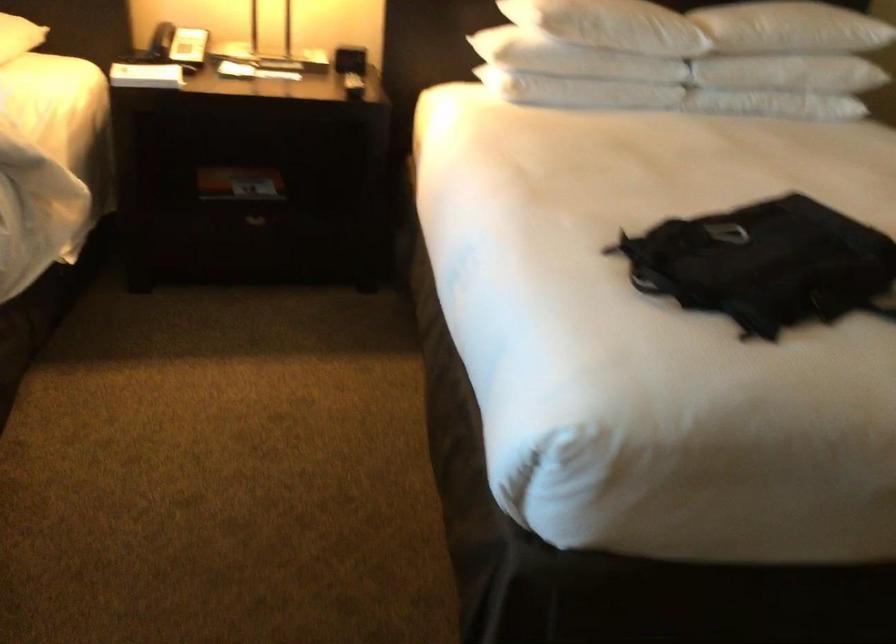
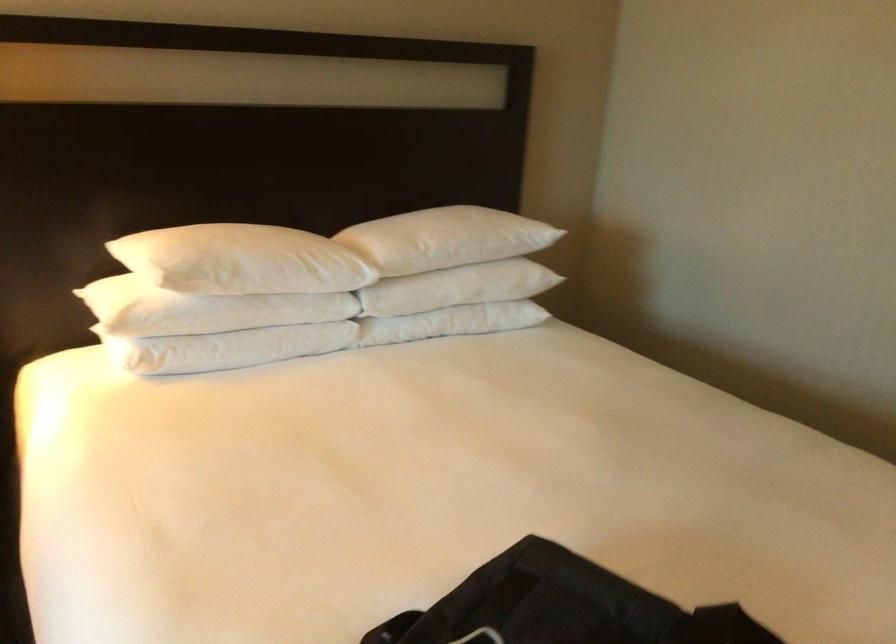
Question: Based on the continuous images, in which direction is the camera rotating? Reply with the corresponding letter.

Choices:
 (A) Left
 (B) Right
 (C) Up
 (D) Down

Answer: (B)